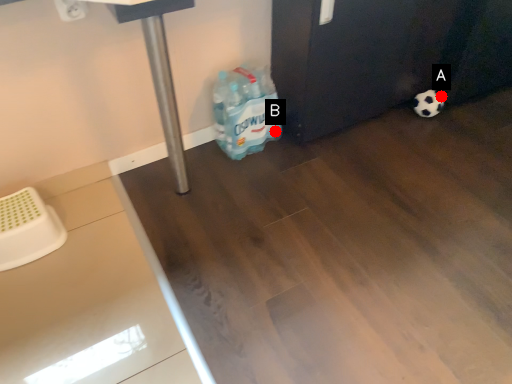
Question: Two points are circled on the image, labeled by A and B beside each circle. Which point is further to the camera?

Choices:
 (A) A is further
 (B) B is further

Answer: (A)